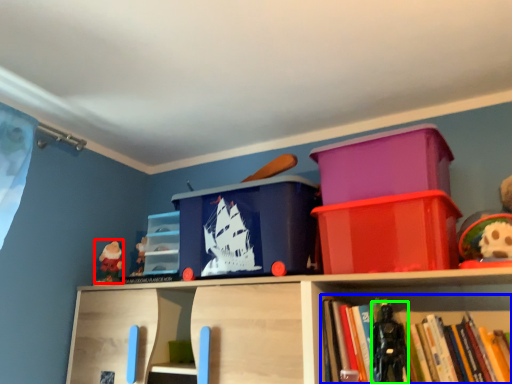
Question: Which object is the farthest from toy (highlighted by a red box)? Choose among these: book (highlighted by a blue box) or toy (highlighted by a green box).

Choices:
 (A) book
 (B) toy

Answer: (A)